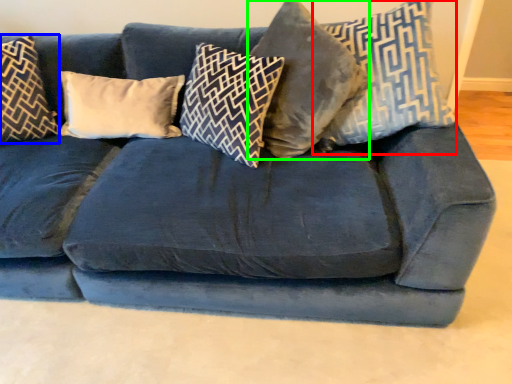
Question: Which object is the closest to the pillow (highlighted by a red box)? Choose among these: pillow (highlighted by a blue box) or pillow (highlighted by a green box).

Choices:
 (A) pillow
 (B) pillow

Answer: (B)